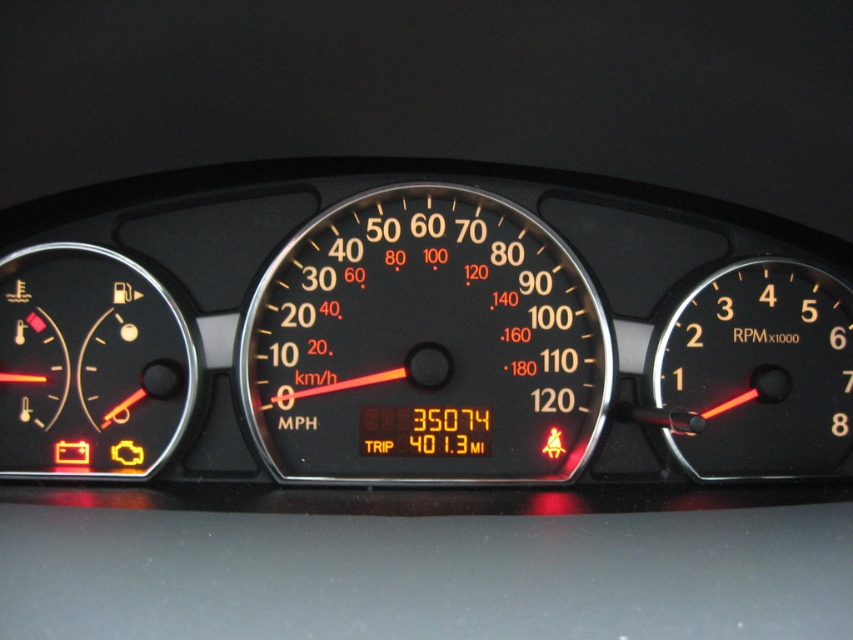
Question: Can you confirm if black plastic speedometer at center is wider than matte black speedometer at left?

Choices:
 (A) yes
 (B) no

Answer: (A)

Question: Which object is the farthest from the black plastic speedometer at center?

Choices:
 (A) black plastic rpm gauge at right
 (B) matte black speedometer at left

Answer: (A)

Question: Can you confirm if black plastic speedometer at center is positioned above black plastic rpm gauge at right?

Choices:
 (A) no
 (B) yes

Answer: (B)

Question: Which of these objects is positioned closest to the black plastic rpm gauge at right?

Choices:
 (A) matte black speedometer at left
 (B) black plastic speedometer at center

Answer: (B)

Question: Which of these objects is positioned closest to the matte black speedometer at left?

Choices:
 (A) black plastic rpm gauge at right
 (B) black plastic speedometer at center

Answer: (B)

Question: Can you confirm if black plastic speedometer at center is smaller than black plastic rpm gauge at right?

Choices:
 (A) no
 (B) yes

Answer: (A)